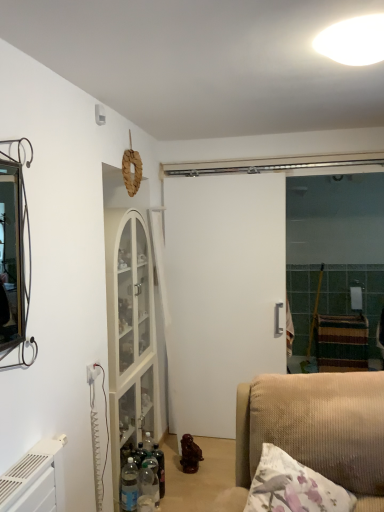
Question: Is white glossy light fixture at upper center behind translucent plastic bottle at lower center, the 1th bottle positioned from the front?

Choices:
 (A) no
 (B) yes

Answer: (A)

Question: Is white glossy light fixture at upper center outside translucent plastic bottle at lower center, the 1th bottle positioned from the front?

Choices:
 (A) yes
 (B) no

Answer: (A)

Question: From the image's perspective, is white glossy light fixture at upper center located above translucent plastic bottle at lower center, which is the 3th bottle from back to front?

Choices:
 (A) no
 (B) yes

Answer: (B)

Question: Considering the relative positions of white glossy light fixture at upper center and translucent plastic bottle at lower center, the 1th bottle positioned from the front, in the image provided, is white glossy light fixture at upper center to the left of translucent plastic bottle at lower center, the 1th bottle positioned from the front, from the viewer's perspective?

Choices:
 (A) no
 (B) yes

Answer: (A)

Question: Is white glossy light fixture at upper center at the right side of translucent plastic bottle at lower center, which is the 3th bottle from back to front?

Choices:
 (A) yes
 (B) no

Answer: (A)

Question: From the image's perspective, relative to white glossy light fixture at upper center, is translucent plastic bottles at lower left, acting as the second bottle starting from the back, above or below?

Choices:
 (A) below
 (B) above

Answer: (A)

Question: From a real-world perspective, is translucent plastic bottles at lower left, the second bottle from the front, above or below white glossy light fixture at upper center?

Choices:
 (A) below
 (B) above

Answer: (A)

Question: In terms of width, does translucent plastic bottles at lower left, acting as the second bottle starting from the back, look wider or thinner when compared to white glossy light fixture at upper center?

Choices:
 (A) wide
 (B) thin

Answer: (B)

Question: Is translucent plastic bottles at lower left, the second bottle from the front, bigger or smaller than white glossy light fixture at upper center?

Choices:
 (A) small
 (B) big

Answer: (A)

Question: From a real-world perspective, is translucent plastic bottle at lower center, the 1th bottle positioned from the front, physically located above or below white glossy light fixture at upper center?

Choices:
 (A) below
 (B) above

Answer: (A)

Question: Would you say translucent plastic bottle at lower center, the 1th bottle positioned from the front, is to the left or to the right of white glossy light fixture at upper center in the picture?

Choices:
 (A) left
 (B) right

Answer: (A)

Question: Relative to white glossy light fixture at upper center, is translucent plastic bottle at lower center, which is the 3th bottle from back to front, in front or behind?

Choices:
 (A) behind
 (B) front

Answer: (A)

Question: Is point (147, 489) positioned closer to the camera than point (362, 15)?

Choices:
 (A) farther
 (B) closer

Answer: (A)

Question: Based on their sizes in the image, would you say translucent plastic bottles at lower left, the second bottle from the front, is bigger or smaller than white matte door at center?

Choices:
 (A) big
 (B) small

Answer: (B)

Question: Does point (125, 487) appear closer or farther from the camera than point (233, 197)?

Choices:
 (A) closer
 (B) farther

Answer: (A)